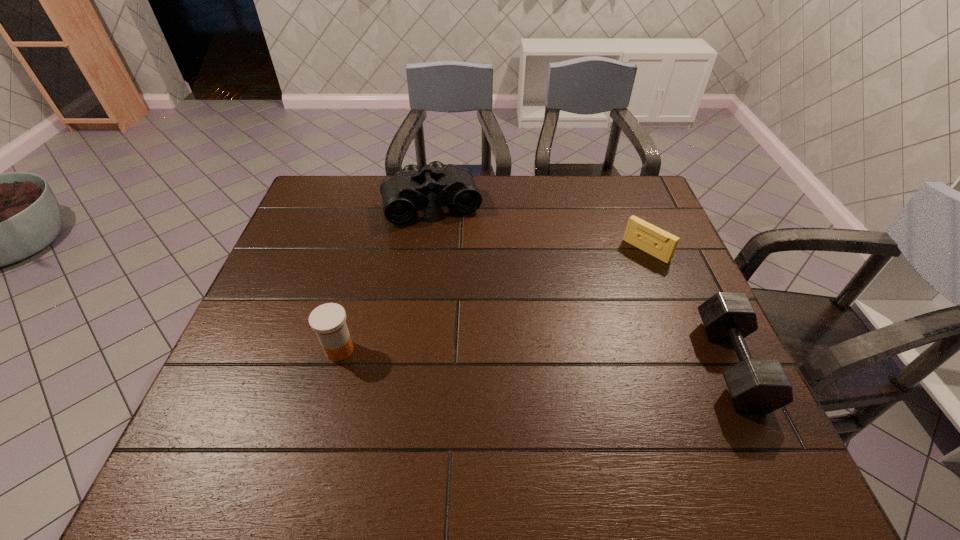
This screenshot has width=960, height=540. I want to click on medicine, so click(328, 320).

This screenshot has height=540, width=960. I want to click on dumbbell, so click(x=755, y=386).

Image resolution: width=960 pixels, height=540 pixels. What are the coordinates of `binoculars` in the screenshot? It's located at (405, 192).

This screenshot has height=540, width=960. I want to click on the shortest object, so click(x=657, y=242).

In order to click on videotape in this screenshot , I will do `click(657, 242)`.

Where is `free location located 0.130m on the label of the medicine`? free location located 0.130m on the label of the medicine is located at coordinates (321, 418).

You are a GUI agent. You are given a task and a screenshot of the screen. Output one action in this format:
    pyautogui.click(x=<x>, y=<y>)
    Task: Click on the vacant space located 0.090m on the back of the dumbbell
    The height and width of the screenshot is (540, 960).
    Given the screenshot: What is the action you would take?
    pyautogui.click(x=698, y=295)

At what (x,y) coordinates should I click in order to perform the action: click on vacant space located 0.080m at the eyepieces of the farthest object. Please return your answer as a coordinate pair (x, y). The image size is (960, 540). Looking at the image, I should click on (448, 243).

Where is `vacant space located 0.230m at the eyepieces of the farthest object`? This screenshot has width=960, height=540. vacant space located 0.230m at the eyepieces of the farthest object is located at coordinates (459, 278).

Find the location of a particular element. free space located 0.320m at the eyepieces of the farthest object is located at coordinates (468, 302).